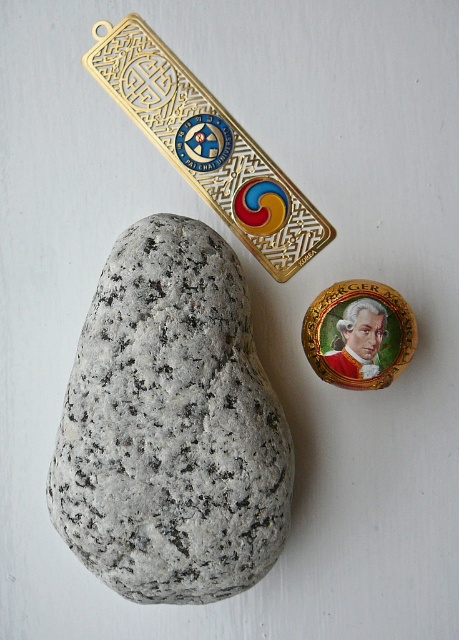
You are organizing a collection of small items and need to determine which object is bigger between the gold metallic bookmark at upper center and the gold metallic badge at upper center. Which one is larger?

The gold metallic bookmark at upper center is larger than the gold metallic badge at upper center according to the description.

You are organizing a collection of metallic items and need to determine the spatial relationship between the gold metallic bookmark at upper center and the gold metallic badge at upper center. Which object is closer to the viewer?

The gold metallic bookmark at upper center is closer to the viewer because the gold metallic badge at upper center is behind it.

You are organizing a display and need to place both the granite rock at center and the gold metallic badge at upper center on a shelf. If the shelf has limited space, which object should you prioritize placing first to ensure both fit?

The granite rock at center is larger in size than the gold metallic badge at upper center, so you should prioritize placing the granite rock at center first to accommodate its larger size before positioning the smaller gold metallic badge at upper center.